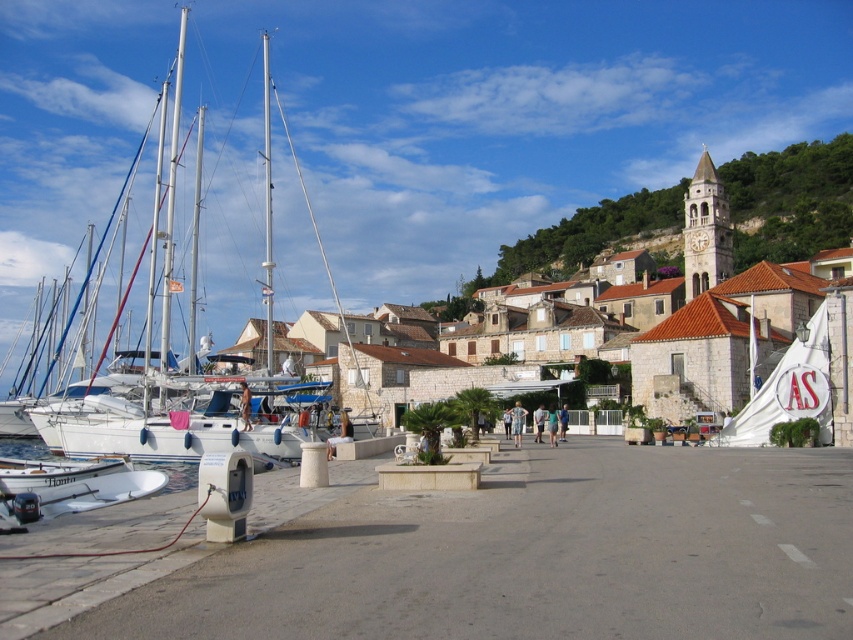
Who is more distant from viewer, (468, 128) or (805, 179)?

Positioned behind is point (468, 128).

Between white glossy sailboat at left and stone clock tower at upper right, which one is positioned lower?

white glossy sailboat at left is below.

Describe the element at coordinates (396, 141) in the screenshot. I see `white glossy sailboat at left` at that location.

Locate an element on the screen. white glossy sailboat at left is located at coordinates (396, 141).

Is point (587, 260) behind point (111, 456)?

Yes, point (587, 260) is behind point (111, 456).

Who is positioned more to the right, stone clock tower at upper right or white matte boat at lower left?

stone clock tower at upper right is more to the right.

Between point (780, 253) and point (62, 508), which one is positioned in front?

Point (62, 508) is in front.

Find the location of `stone clock tower at upper right`. stone clock tower at upper right is located at coordinates (792, 196).

Is white glossy sailboat at left to the right of white matte boat at lower left from the viewer's perspective?

Incorrect, white glossy sailboat at left is not on the right side of white matte boat at lower left.

Is white glossy sailboat at left bigger than white matte boat at lower left?

Indeed, white glossy sailboat at left has a larger size compared to white matte boat at lower left.

The image size is (853, 640). Find the location of `white glossy sailboat at left`. white glossy sailboat at left is located at coordinates (396, 141).